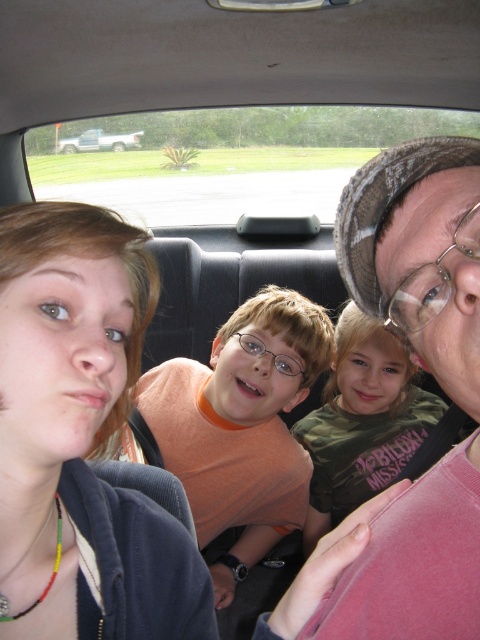
Can you confirm if orange t-shirt at center is positioned to the left of silver metallic truck at rear left?

No, orange t-shirt at center is not to the left of silver metallic truck at rear left.

Is point (301, 372) closer to viewer compared to point (140, 145)?

Yes, point (301, 372) is in front of point (140, 145).

This screenshot has height=640, width=480. Describe the element at coordinates (238, 426) in the screenshot. I see `orange t-shirt at center` at that location.

Find the location of `orange t-shirt at center`. orange t-shirt at center is located at coordinates (238, 426).

Identify the location of pink fabric at upper right. (420, 253).

At what (x,y) coordinates should I click in order to perform the action: click on pink fabric at upper right. Please return your answer as a coordinate pair (x, y). The width and height of the screenshot is (480, 640). Looking at the image, I should click on (420, 253).

Which is above, matte blue hoodie at left or silver metallic truck at rear left?

silver metallic truck at rear left is above.

Locate an element on the screen. The width and height of the screenshot is (480, 640). matte blue hoodie at left is located at coordinates (81, 436).

Measure the distance between point (62, 612) and camera.

Point (62, 612) and camera are 48.77 centimeters apart from each other.

The width and height of the screenshot is (480, 640). Identify the location of matte blue hoodie at left. (81, 436).